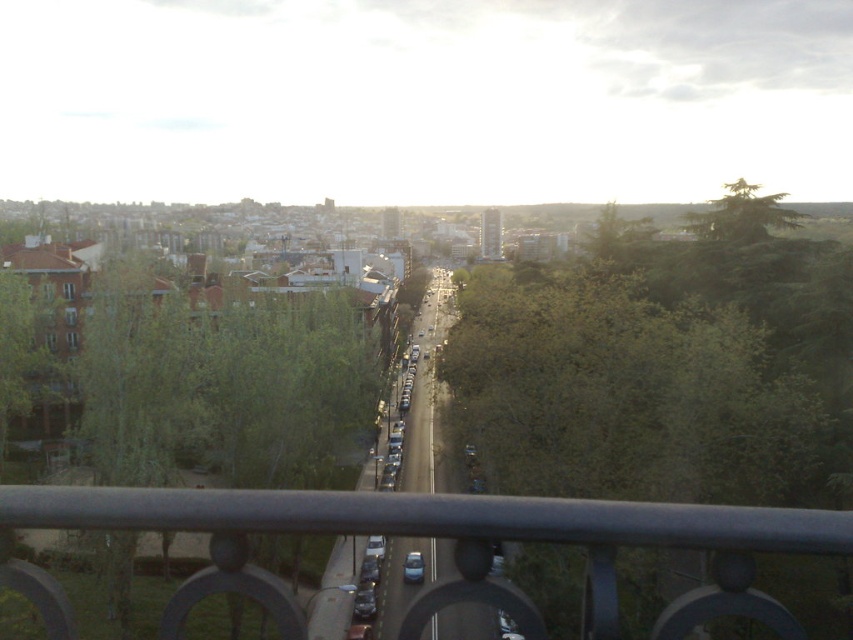
You are standing on a balcony and see the green leafy tree at center and the metallic gray railing at center. Which object appears larger in the scene?

The green leafy tree at center appears larger than the metallic gray railing at center.